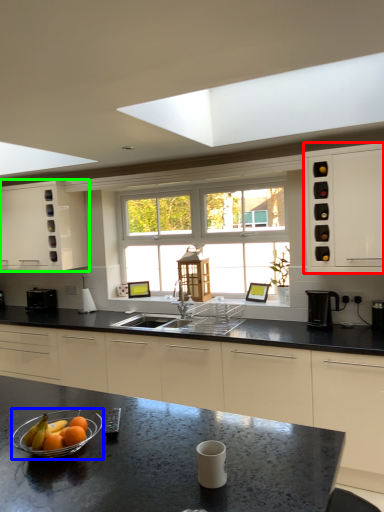
Question: Which is nearer to the cabinetry (highlighted by a red box)? glass bowl (highlighted by a blue box) or cabinetry (highlighted by a green box).

Choices:
 (A) glass bowl
 (B) cabinetry

Answer: (A)